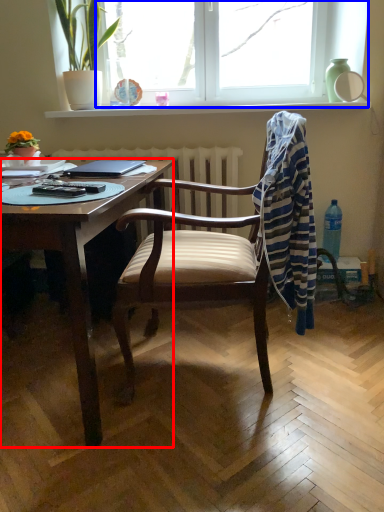
Question: Which object is closer to the camera taking this photo, desk (highlighted by a red box) or window (highlighted by a blue box)?

Choices:
 (A) desk
 (B) window

Answer: (A)